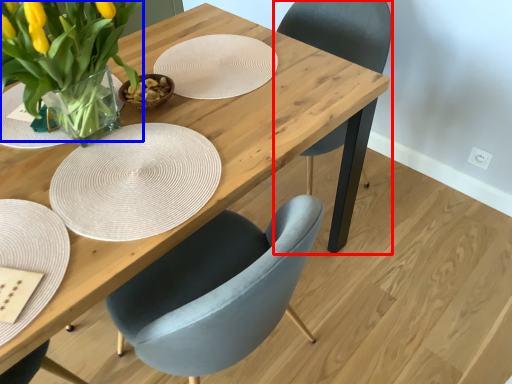
Question: Which of the following is the farthest to the observer, chair (highlighted by a red box) or floral arrangement (highlighted by a blue box)?

Choices:
 (A) chair
 (B) floral arrangement

Answer: (A)